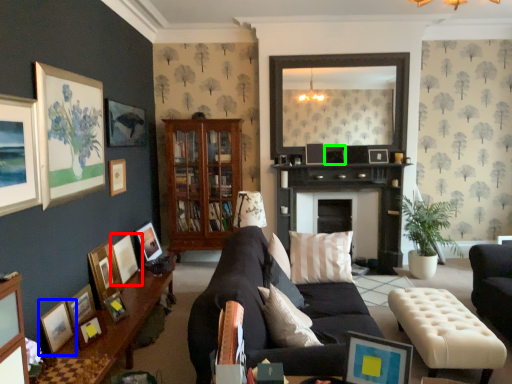
Question: Which object is positioned closest to picture frame (highlighted by a red box)? Select from picture frame (highlighted by a blue box) and picture frame (highlighted by a green box).

Choices:
 (A) picture frame
 (B) picture frame

Answer: (A)